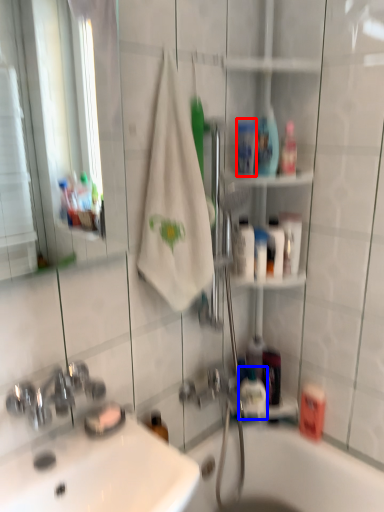
Question: Which of the following is the farthest to the observer, mouthwash (highlighted by a red box) or mouthwash (highlighted by a blue box)?

Choices:
 (A) mouthwash
 (B) mouthwash

Answer: (B)